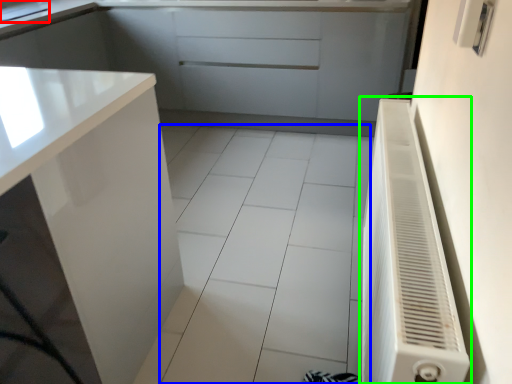
Question: Considering the real-world distances, which object is farthest from sink (highlighted by a red box)? ceramic tile (highlighted by a blue box) or air conditioner (highlighted by a green box)?

Choices:
 (A) ceramic tile
 (B) air conditioner

Answer: (B)